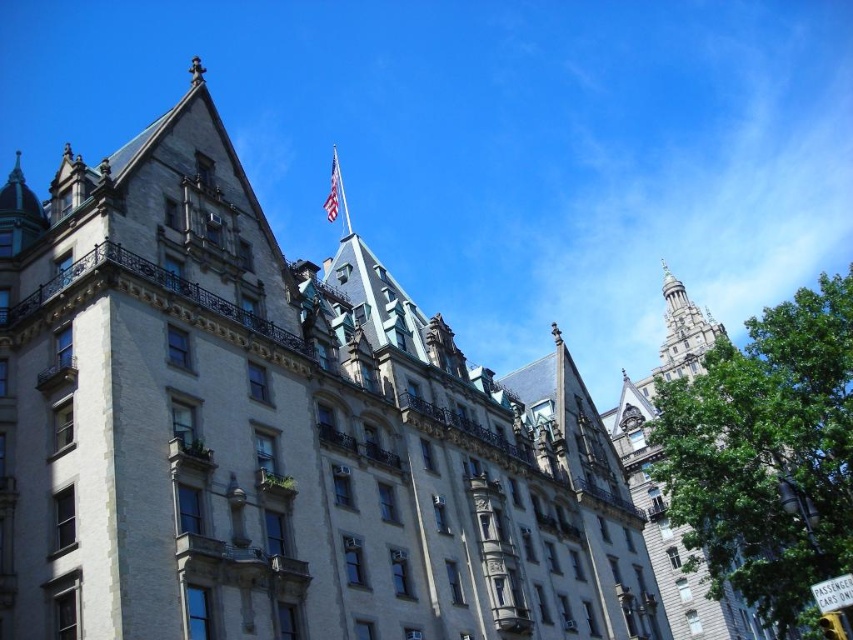
Question: Which point appears closest to the camera in this image?

Choices:
 (A) (334, 202)
 (B) (86, 637)

Answer: (B)

Question: Among these points, which one is farthest from the camera?

Choices:
 (A) (198, 557)
 (B) (700, 598)

Answer: (B)

Question: Can you confirm if white stone building at center is smaller than american flag at upper center?

Choices:
 (A) yes
 (B) no

Answer: (B)

Question: From the image, what is the correct spatial relationship of white stone building at center in relation to stone tower at upper right?

Choices:
 (A) above
 (B) below

Answer: (A)

Question: Does white stone building at center have a lesser width compared to american flag at upper center?

Choices:
 (A) no
 (B) yes

Answer: (A)

Question: Estimate the real-world distances between objects in this image. Which object is farther from the stone tower at upper right?

Choices:
 (A) white stone building at center
 (B) american flag at upper center

Answer: (B)